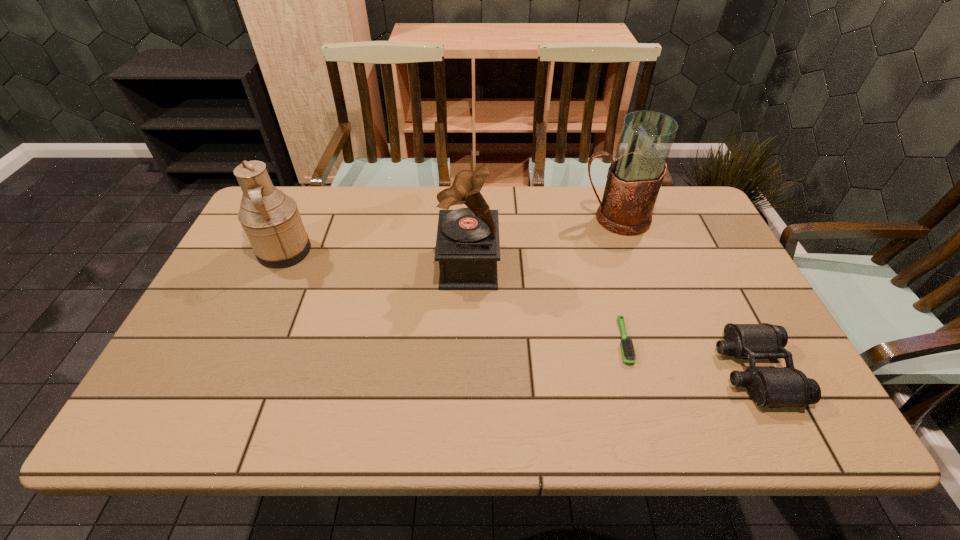
The image size is (960, 540). I want to click on free space at the far edge, so click(x=565, y=227).

Locate an element on the screen. The height and width of the screenshot is (540, 960). free point at the left edge is located at coordinates (246, 313).

At what (x,y) coordinates should I click in order to perform the action: click on vacant space at the right edge of the desktop. Please return your answer as a coordinate pair (x, y). The image size is (960, 540). Looking at the image, I should click on (761, 323).

Find the location of `vacant space at the near left corner of the desktop`. vacant space at the near left corner of the desktop is located at coordinates (213, 398).

Where is `vacant space at the far right corner of the desktop`? The width and height of the screenshot is (960, 540). vacant space at the far right corner of the desktop is located at coordinates (689, 228).

Locate an element on the screen. This screenshot has height=540, width=960. vacant area that lies between the binoculars and the hairbrush is located at coordinates (689, 356).

This screenshot has height=540, width=960. I want to click on unoccupied position between the fourth object from right to left and the right pitcher, so click(541, 241).

Image resolution: width=960 pixels, height=540 pixels. Find the location of `unoccupied position between the rightmost object and the hairbrush`. unoccupied position between the rightmost object and the hairbrush is located at coordinates (689, 356).

Locate an element on the screen. The image size is (960, 540). blank region between the phonograph_record and the right pitcher is located at coordinates (541, 241).

Locate an element on the screen. free space between the binoculars and the shortest object is located at coordinates (689, 356).